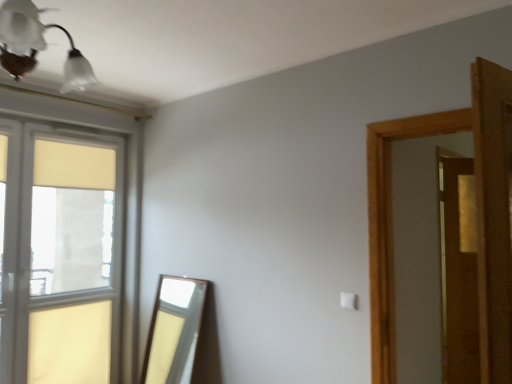
Question: Based on their sizes in the image, would you say white glass light fixture at upper left is bigger or smaller than wooden screen door at right?

Choices:
 (A) big
 (B) small

Answer: (A)

Question: Considering the positions of point (33, 59) and point (448, 334), is point (33, 59) closer or farther from the camera than point (448, 334)?

Choices:
 (A) farther
 (B) closer

Answer: (B)

Question: Estimate the real-world distances between objects in this image. Which object is farther from the white glass light fixture at upper left?

Choices:
 (A) wooden screen door at right
 (B) wooden door at right
 (C) matte glass window at left

Answer: (A)

Question: Estimate the real-world distances between objects in this image. Which object is closer to the wooden door at right?

Choices:
 (A) wooden screen door at right
 (B) matte glass window at left
 (C) white glass light fixture at upper left

Answer: (A)